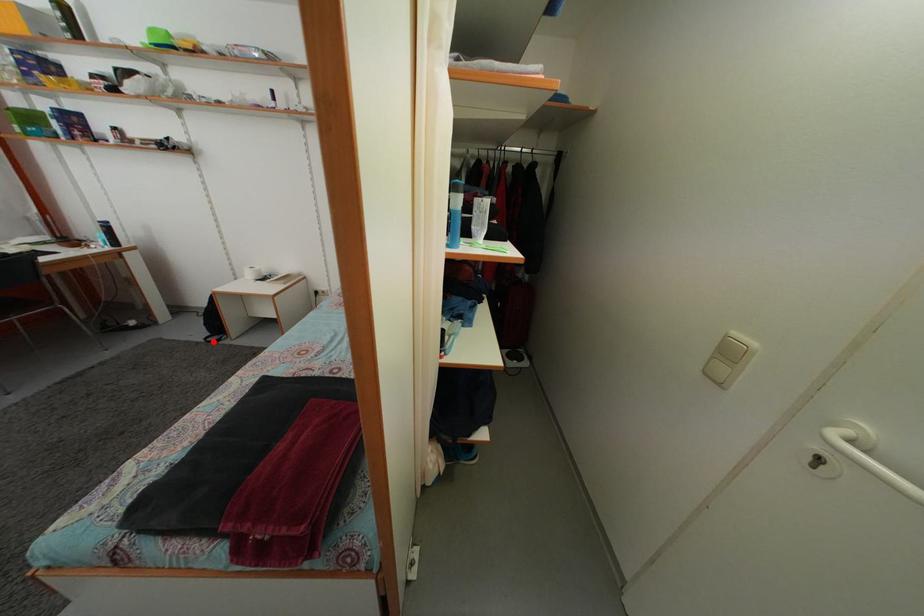
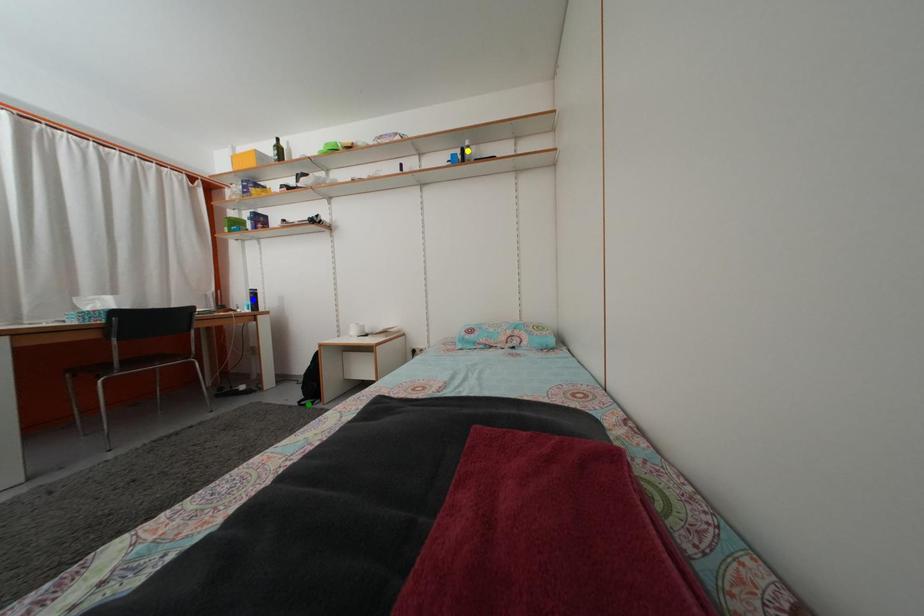
Question: I am providing you with two images of the same scene from different viewpoints. A red point is marked on the first image. You are given multiple points on the second image. Which point in image 2 is actually the same real-world point as the red point in image 1?

Choices:
 (A) green point
 (B) blue point
 (C) yellow point

Answer: (A)